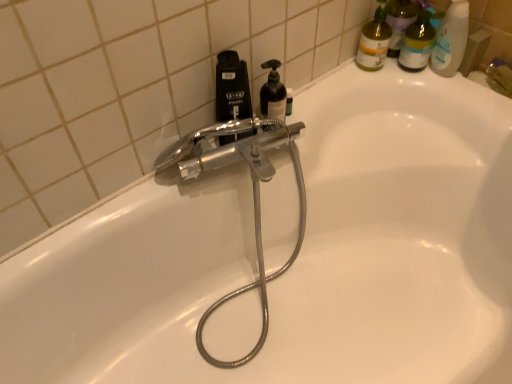
What do you see at coordinates (232, 88) in the screenshot? I see `black matte soap dispenser at upper center` at bounding box center [232, 88].

In order to face black matte soap dispenser at upper center, should I rotate leftwards or rightwards?

You should rotate right by 2.471 degrees.

Locate an element on the screen. This screenshot has width=512, height=384. black matte soap dispenser at upper center is located at coordinates (232, 88).

Is translucent plastic bottles at upper right placed right next to matte yellow bottle at upper right?

Yes, the surface of translucent plastic bottles at upper right is in contact with matte yellow bottle at upper right.

Relative to matte yellow bottle at upper right, is translucent plastic bottles at upper right in front or behind?

In the image, translucent plastic bottles at upper right appears in front of matte yellow bottle at upper right.

Looking at their sizes, would you say translucent plastic bottles at upper right is wider or thinner than matte yellow bottle at upper right?

Clearly, translucent plastic bottles at upper right has more width compared to matte yellow bottle at upper right.

Who is shorter, translucent plastic bottles at upper right or matte yellow bottle at upper right?

Standing shorter between the two is matte yellow bottle at upper right.

Considering the sizes of objects black matte soap dispenser at upper center and black matte soap dispenser at upper center in the image provided, who is thinner, black matte soap dispenser at upper center or black matte soap dispenser at upper center?

black matte soap dispenser at upper center is thinner.

Based on their positions, is black matte soap dispenser at upper center located to the left or right of black matte soap dispenser at upper center?

Clearly, black matte soap dispenser at upper center is on the right of black matte soap dispenser at upper center in the image.

From the image's perspective, who appears lower, black matte soap dispenser at upper center or black matte soap dispenser at upper center?

From the image's view, black matte soap dispenser at upper center is below.

Does matte yellow bottle at upper right have a lesser height compared to translucent plastic bottles at upper right?

Correct, matte yellow bottle at upper right is not as tall as translucent plastic bottles at upper right.

Locate an element on the screen. toiletry that appears on the right of matte yellow bottle at upper right is located at coordinates (417, 43).

From the image's perspective, is matte yellow bottle at upper right on top of translucent plastic bottles at upper right?

Yes, from the image's perspective, matte yellow bottle at upper right is on top of translucent plastic bottles at upper right.

Is matte yellow bottle at upper right at the left side of translucent plastic bottles at upper right?

Indeed, matte yellow bottle at upper right is positioned on the left side of translucent plastic bottles at upper right.

The image size is (512, 384). Identify the location of cleaning product behind the black matte soap dispenser at upper center. coord(374,41).

Who is smaller, black matte soap dispenser at upper center or matte yellow bottle at upper right?

matte yellow bottle at upper right is smaller.

Is black matte soap dispenser at upper center inside the boundaries of matte yellow bottle at upper right, or outside?

black matte soap dispenser at upper center is not inside matte yellow bottle at upper right, it's outside.

Based on the photo, is black matte soap dispenser at upper center looking in the opposite direction of matte yellow bottle at upper right?

No, black matte soap dispenser at upper center is not facing the opposite direction of matte yellow bottle at upper right.

Which is closer, [424,42] or [228,70]?

Clearly, point [424,42] is more distant from the camera than point [228,70].

Which is more to the left, translucent plastic bottles at upper right or black matte soap dispenser at upper center?

black matte soap dispenser at upper center.

Is translucent plastic bottles at upper right oriented away from black matte soap dispenser at upper center?

translucent plastic bottles at upper right does not have its back to black matte soap dispenser at upper center.

Find the location of a particular element. toiletry located behind the black matte soap dispenser at upper center is located at coordinates (417, 43).

Would you say matte yellow bottle at upper right is part of black matte soap dispenser at upper center's contents?

That's incorrect, matte yellow bottle at upper right is not inside black matte soap dispenser at upper center.

Would you say black matte soap dispenser at upper center is to the left or to the right of matte yellow bottle at upper right in the picture?

Clearly, black matte soap dispenser at upper center is on the left of matte yellow bottle at upper right in the image.

Find the location of a particular element. This screenshot has height=384, width=512. cleaning product that is above the black matte soap dispenser at upper center (from the image's perspective) is located at coordinates (374, 41).

Is black matte soap dispenser at upper center next to matte yellow bottle at upper right and touching it?

No, black matte soap dispenser at upper center is not next to matte yellow bottle at upper right.

From a real-world perspective, is matte yellow bottle at upper right physically below black matte soap dispenser at upper center?

No.

Find the location of a particular element. This screenshot has width=512, height=384. cleaning product above the black matte soap dispenser at upper center (from a real-world perspective) is located at coordinates (374, 41).

Which object is closer to the camera taking this photo, matte yellow bottle at upper right or black matte soap dispenser at upper center?

black matte soap dispenser at upper center is closer to the camera.

Locate an element on the screen. Image resolution: width=512 pixels, height=384 pixels. cleaning product below the translucent plastic bottles at upper right (from a real-world perspective) is located at coordinates click(x=374, y=41).

Identify the location of bottle positioned vertically above the black matte soap dispenser at upper center (from a real-world perspective). (232, 88).

Considering their positions, is black matte soap dispenser at upper center positioned closer to translucent plastic bottles at upper right than black matte soap dispenser at upper center?

Based on the image, black matte soap dispenser at upper center appears to be nearer to translucent plastic bottles at upper right.

When comparing their distances from matte yellow bottle at upper right, does black matte soap dispenser at upper center or translucent plastic bottles at upper right seem closer?

The object closer to matte yellow bottle at upper right is translucent plastic bottles at upper right.

From the image, which object appears to be nearer to black matte soap dispenser at upper center, matte yellow bottle at upper right or black matte soap dispenser at upper center?

black matte soap dispenser at upper center.

Considering their positions, is black matte soap dispenser at upper center positioned closer to translucent plastic bottles at upper right than matte yellow bottle at upper right?

matte yellow bottle at upper right is closer to translucent plastic bottles at upper right.

Estimate the real-world distances between objects in this image. Which object is closer to translucent plastic bottles at upper right, black matte soap dispenser at upper center or black matte soap dispenser at upper center?

black matte soap dispenser at upper center is closer to translucent plastic bottles at upper right.

Based on the photo, from the image, which object appears to be farther from black matte soap dispenser at upper center, translucent plastic bottles at upper right or black matte soap dispenser at upper center?

translucent plastic bottles at upper right is further to black matte soap dispenser at upper center.

When comparing their distances from translucent plastic bottles at upper right, does black matte soap dispenser at upper center or matte yellow bottle at upper right seem further?

black matte soap dispenser at upper center lies further to translucent plastic bottles at upper right than the other object.

Based on the photo, looking at the image, which one is located further to black matte soap dispenser at upper center, black matte soap dispenser at upper center or translucent plastic bottles at upper right?

translucent plastic bottles at upper right lies further to black matte soap dispenser at upper center than the other object.

Find the location of a particular element. cleaning product between black matte soap dispenser at upper center and translucent plastic bottles at upper right from left to right is located at coordinates (374, 41).

Locate an element on the screen. The width and height of the screenshot is (512, 384). cleaning product between black matte soap dispenser at upper center and translucent plastic bottles at upper right in the horizontal direction is located at coordinates (374, 41).

Image resolution: width=512 pixels, height=384 pixels. What are the coordinates of `soap dispenser between black matte soap dispenser at upper center and translucent plastic bottles at upper right` in the screenshot? It's located at (273, 93).

Image resolution: width=512 pixels, height=384 pixels. In order to click on soap dispenser located between black matte soap dispenser at upper center and matte yellow bottle at upper right in the left-right direction in this screenshot , I will do (273, 93).